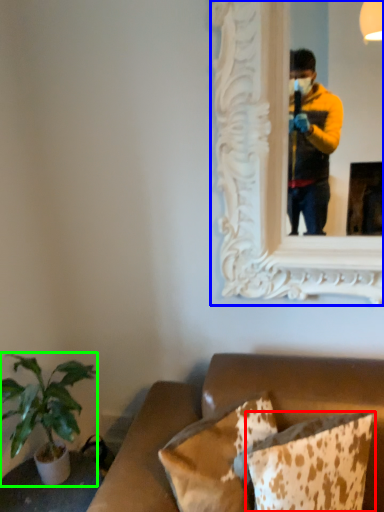
Question: Based on their relative distances, which object is nearer to pillow (highlighted by a red box)? Choose from picture frame (highlighted by a blue box) and houseplant (highlighted by a green box).

Choices:
 (A) picture frame
 (B) houseplant

Answer: (B)